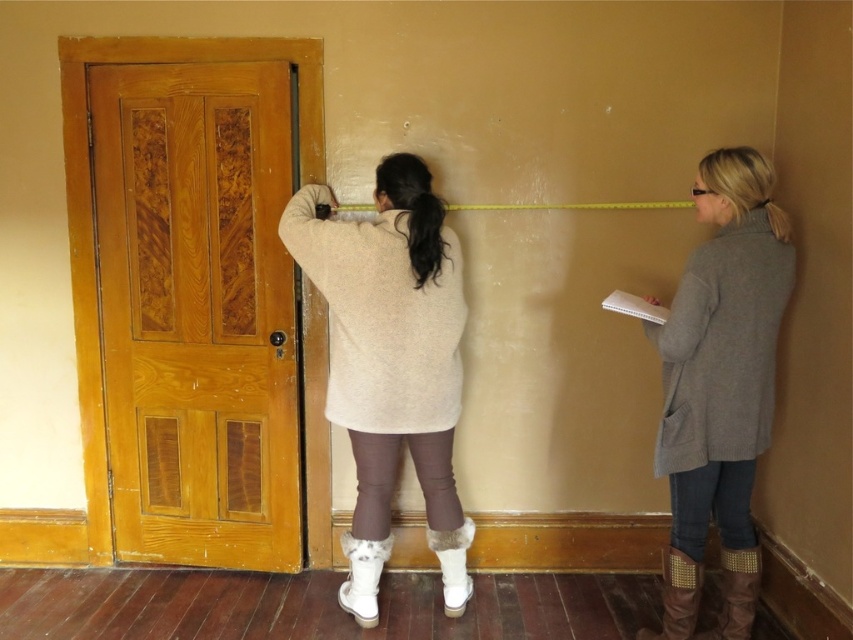
Who is higher up, brown leather boot at lower right or white fur boot at lower center?

Positioned higher is white fur boot at lower center.

Which of these two, brown leather boot at lower right or white fur boot at lower center, stands taller?

With more height is brown leather boot at lower right.

Describe the element at coordinates (677, 596) in the screenshot. I see `brown leather boot at lower right` at that location.

Find the location of a particular element. Image resolution: width=853 pixels, height=640 pixels. brown leather boot at lower right is located at coordinates (677, 596).

Can you confirm if brown studded boot at lower right is positioned to the right of brown leather boot at lower right?

Indeed, brown studded boot at lower right is positioned on the right side of brown leather boot at lower right.

This screenshot has width=853, height=640. Find the location of `brown studded boot at lower right`. brown studded boot at lower right is located at coordinates (735, 593).

Locate an element on the screen. This screenshot has width=853, height=640. brown studded boot at lower right is located at coordinates (735, 593).

Is wooden door at left positioned behind white fur boot at lower center?

Yes, it is.

The width and height of the screenshot is (853, 640). What do you see at coordinates (196, 310) in the screenshot? I see `wooden door at left` at bounding box center [196, 310].

You are a GUI agent. You are given a task and a screenshot of the screen. Output one action in this format:
    pyautogui.click(x=<x>, y=<y>)
    Task: Click on the wooden door at left
    The width and height of the screenshot is (853, 640).
    Given the screenshot: What is the action you would take?
    pyautogui.click(x=196, y=310)